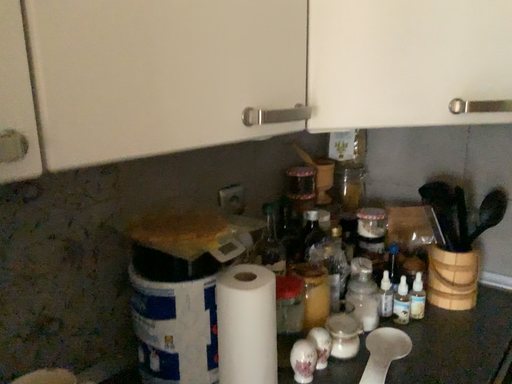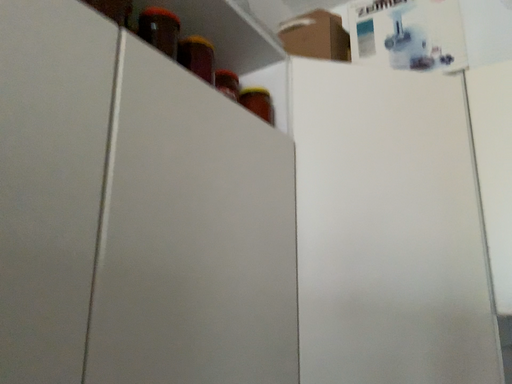
Question: How did the camera likely rotate when shooting the video?

Choices:
 (A) rotated upward
 (B) rotated downward

Answer: (A)